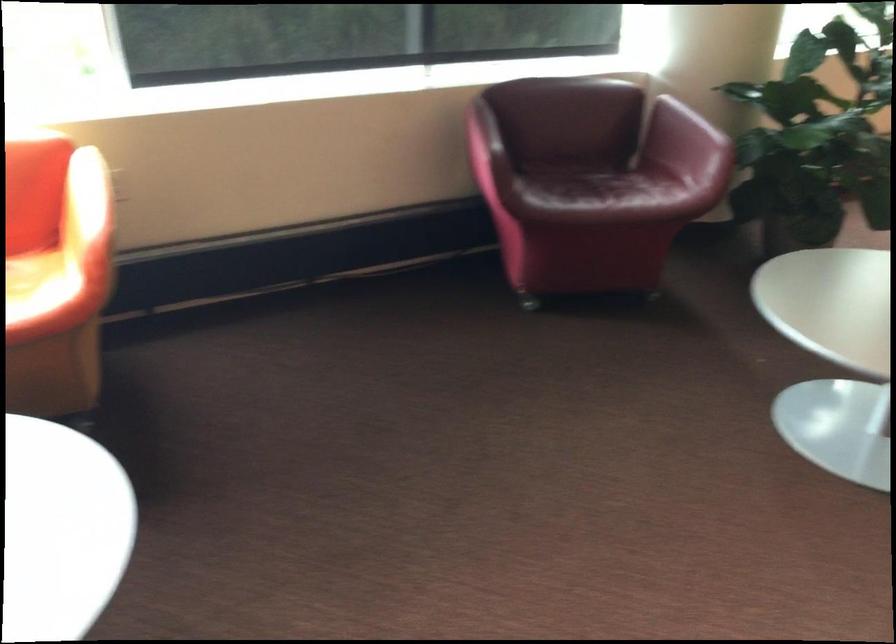
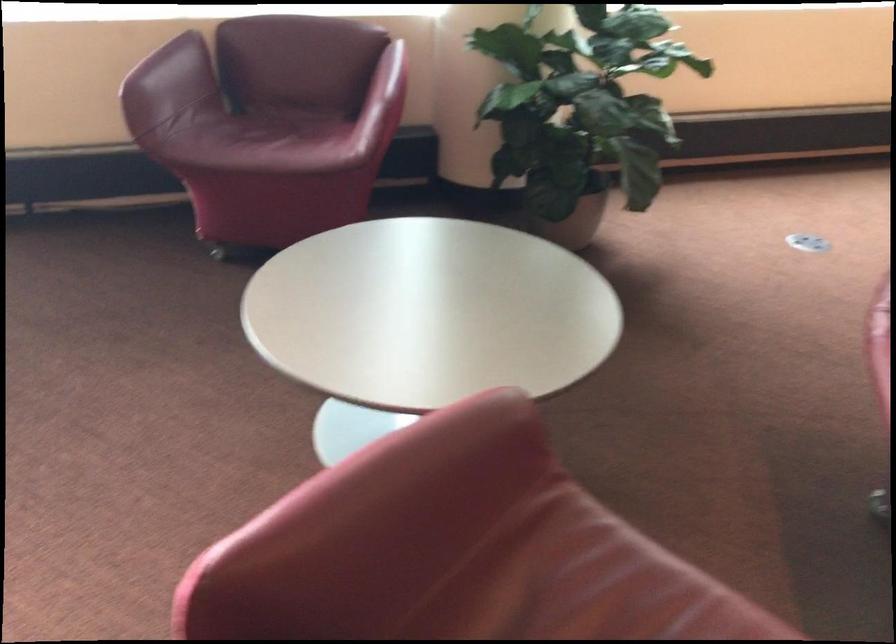
Question: What movement of the cameraman would produce the second image?

Choices:
 (A) Left
 (B) Right
 (C) Forward
 (D) Backward

Answer: (B)